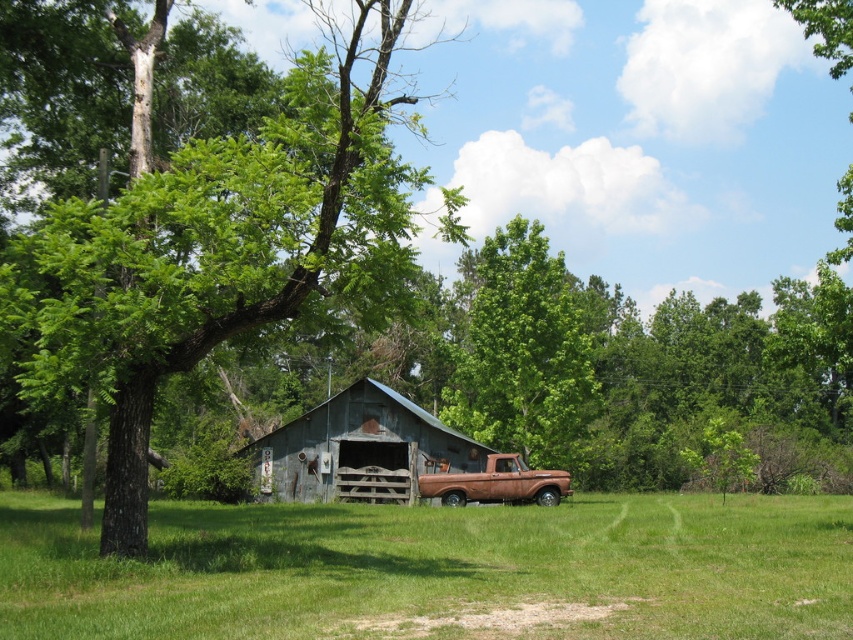
Describe the element at coordinates (436, 566) in the screenshot. I see `green grass at lower center` at that location.

Who is more forward, (165, 508) or (277, 442)?

Positioned in front is point (165, 508).

Is point (49, 625) positioned after point (399, 460)?

No, (49, 625) is closer to viewer.

The image size is (853, 640). In order to click on green grass at lower center in this screenshot , I will do `click(436, 566)`.

Is green leafy tree at center above rusty metal barn at center?

Indeed, green leafy tree at center is positioned over rusty metal barn at center.

Is point (547, 243) closer to viewer compared to point (300, 486)?

No, it is not.

Is point (491, 259) in front of point (328, 401)?

No, it is not.

The width and height of the screenshot is (853, 640). In order to click on green leafy tree at center in this screenshot , I will do `click(523, 353)`.

Can you confirm if green leafy tree at left is wider than green grass at lower center?

No.

Is green leafy tree at left shorter than green grass at lower center?

No.

Identify the location of green leafy tree at left. (219, 243).

What are the coordinates of `green leafy tree at left` in the screenshot? It's located at (219, 243).